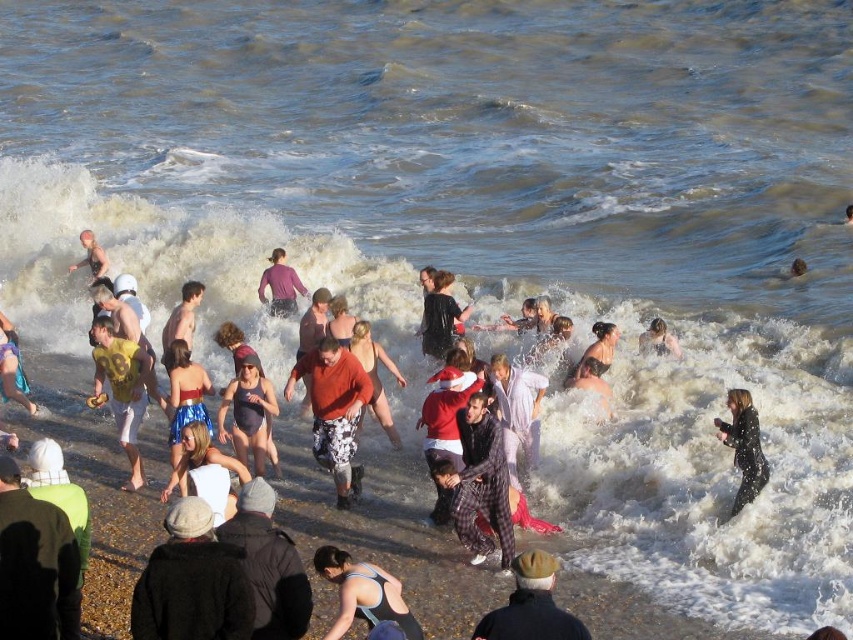
Is point (444, 320) positioned in front of point (790, 272)?

Yes.

Who is positioned more to the left, matte black coat at center or smooth skin person at center?

matte black coat at center is more to the left.

Who is more distant from viewer, (445, 276) or (795, 262)?

Positioned behind is point (795, 262).

Image resolution: width=853 pixels, height=640 pixels. I want to click on matte black coat at center, so click(440, 316).

What do you see at coordinates (531, 605) in the screenshot? The height and width of the screenshot is (640, 853). I see `dark brown wool cap at lower center` at bounding box center [531, 605].

Does dark brown wool cap at lower center appear over smooth skin person at center?

No.

This screenshot has width=853, height=640. In order to click on dark brown wool cap at lower center in this screenshot , I will do `click(531, 605)`.

Based on the photo, does light skin tone flesh at lower left have a lesser width compared to smooth skin person at center?

In fact, light skin tone flesh at lower left might be wider than smooth skin person at center.

Is light skin tone flesh at lower left closer to the viewer compared to smooth skin person at center?

Yes, light skin tone flesh at lower left is closer to the viewer.

Which is in front, point (88, 236) or point (796, 259)?

Point (88, 236) is in front.

Identify the location of light skin tone flesh at lower left. (91, 259).